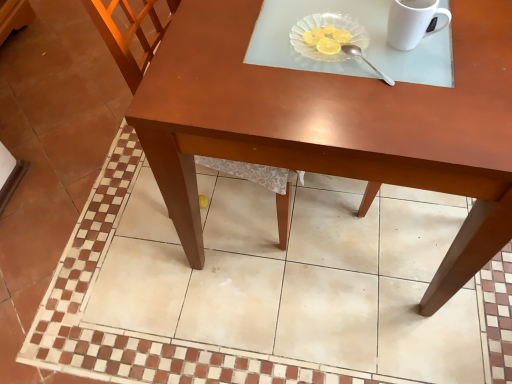
This screenshot has height=384, width=512. Describe the element at coordinates (181, 175) in the screenshot. I see `wooden chair at center` at that location.

You are a GUI agent. You are given a task and a screenshot of the screen. Output one action in this format:
    pyautogui.click(x=<x>, y=<y>)
    Task: Click on the silver metallic spoon at upper center
    
    Given the screenshot: What is the action you would take?
    pyautogui.click(x=365, y=61)

This screenshot has height=384, width=512. Find the location of `wooden chair at center`. wooden chair at center is located at coordinates (181, 175).

Does point (352, 28) lie in front of point (487, 133)?

No, (352, 28) is behind (487, 133).

Does transparent glass plate at upper center turn towards matte wood table at center?

No, transparent glass plate at upper center is not oriented towards matte wood table at center.

Does transparent glass plate at upper center have a lesser height compared to matte wood table at center?

Correct, transparent glass plate at upper center is not as tall as matte wood table at center.

Between transparent glass plate at upper center and matte wood table at center, which one has smaller width?

Thinner between the two is transparent glass plate at upper center.

What are the coordinates of `square on the left of matte wood table at center` in the screenshot? It's located at (256, 286).

Which is in front, point (256, 132) or point (233, 310)?

The point (256, 132) is closer to the camera.

In the scene shown: Can you see matte wood table at center touching matte brown table at center?

matte wood table at center is not next to matte brown table at center, and they're not touching.

From a real-world perspective, who is located higher, matte wood table at center or matte brown table at center?

From a 3D spatial view, matte wood table at center is above.

Is point (480, 3) positioned behind point (159, 128)?

That is True.

How different are the orientations of matte wood table at center and wooden chair at center in degrees?

The angle between the facing direction of matte wood table at center and the facing direction of wooden chair at center is 178 degrees.

Could you tell me if matte wood table at center is turned towards wooden chair at center?

Yes, matte wood table at center is facing wooden chair at center.

From the picture: Considering the relative sizes of matte wood table at center and wooden chair at center in the image provided, is matte wood table at center wider than wooden chair at center?

Yes, matte wood table at center is wider than wooden chair at center.

Locate an element on the screen. This screenshot has width=512, height=384. coffee cup in front of the matte brown table at center is located at coordinates (413, 22).

Is matte brown table at center positioned far away from white glossy mug at upper right?

No, matte brown table at center is not far from white glossy mug at upper right.

From the image's perspective, who appears lower, matte brown table at center or white glossy mug at upper right?

matte brown table at center, from the image's perspective.

Considering the relative sizes of matte brown table at center and white glossy mug at upper right in the image provided, is matte brown table at center taller than white glossy mug at upper right?

No.

Which is further, (397,2) or (346,53)?

Point (346,53)

Where is `coffee cup above the silver metallic spoon at upper center (from the image's perspective)`? coffee cup above the silver metallic spoon at upper center (from the image's perspective) is located at coordinates (413, 22).

Is silver metallic spoon at upper center at the back of white glossy mug at upper right?

No, white glossy mug at upper right is not facing the opposite direction of silver metallic spoon at upper center.

Measure the distance between white glossy mug at upper right and silver metallic spoon at upper center.

white glossy mug at upper right and silver metallic spoon at upper center are 12.32 centimeters apart from each other.

Would you consider transparent glass plate at upper center to be distant from silver metallic spoon at upper center?

No, transparent glass plate at upper center is not far from silver metallic spoon at upper center.

Does transparent glass plate at upper center have a larger size compared to silver metallic spoon at upper center?

Yes, transparent glass plate at upper center is bigger than silver metallic spoon at upper center.

What's the angular difference between transparent glass plate at upper center and silver metallic spoon at upper center's facing directions?

The facing directions of transparent glass plate at upper center and silver metallic spoon at upper center are 40.5 degrees apart.

Measure the distance from transparent glass plate at upper center to silver metallic spoon at upper center.

transparent glass plate at upper center and silver metallic spoon at upper center are 2.98 inches apart.

Does point (160, 49) lie behind point (416, 29)?

Yes.

Consider the image. Would you consider matte wood table at center to be distant from white glossy mug at upper right?

No, matte wood table at center is not far away from white glossy mug at upper right.

Which is correct: matte wood table at center is inside white glossy mug at upper right, or outside of it?

matte wood table at center is located beyond the bounds of white glossy mug at upper right.

I want to click on glass plate behind the matte wood table at center, so click(x=324, y=25).

Where is `square below the matte wood table at center (from a real-world perspective)`? Image resolution: width=512 pixels, height=384 pixels. square below the matte wood table at center (from a real-world perspective) is located at coordinates (256, 286).

Based on their spatial positions, is wooden chair at center or white glossy mug at upper right further from matte brown table at center?

white glossy mug at upper right is positioned further to the anchor matte brown table at center.

Based on their spatial positions, is silver metallic spoon at upper center or matte wood table at center further from white glossy mug at upper right?

matte wood table at center lies further to white glossy mug at upper right than the other object.

Which object lies further to the anchor point silver metallic spoon at upper center, matte wood table at center or matte brown table at center?

Based on the image, matte brown table at center appears to be further to silver metallic spoon at upper center.

From the image, which object appears to be farther from matte wood table at center, silver metallic spoon at upper center or wooden chair at center?

silver metallic spoon at upper center is positioned further to the anchor matte wood table at center.

Estimate the real-world distances between objects in this image. Which object is further from white glossy mug at upper right, wooden chair at center or transparent glass plate at upper center?

wooden chair at center is positioned further to the anchor white glossy mug at upper right.

When comparing their distances from white glossy mug at upper right, does matte brown table at center or wooden chair at center seem further?

matte brown table at center lies further to white glossy mug at upper right than the other object.

When comparing their distances from silver metallic spoon at upper center, does wooden chair at center or transparent glass plate at upper center seem closer?

Among the two, transparent glass plate at upper center is located nearer to silver metallic spoon at upper center.

Considering their positions, is transparent glass plate at upper center positioned further to matte brown table at center than white glossy mug at upper right?

white glossy mug at upper right is positioned further to the anchor matte brown table at center.

Image resolution: width=512 pixels, height=384 pixels. In order to click on chair between matte brown table at center and matte wood table at center in the horizontal direction in this screenshot , I will do 181,175.

I want to click on chair between matte brown table at center and white glossy mug at upper right, so click(181, 175).

Locate an element on the screen. spoon between wooden chair at center and matte wood table at center in the horizontal direction is located at coordinates (365, 61).

I want to click on glass plate located between matte brown table at center and silver metallic spoon at upper center in the left-right direction, so click(324, 25).